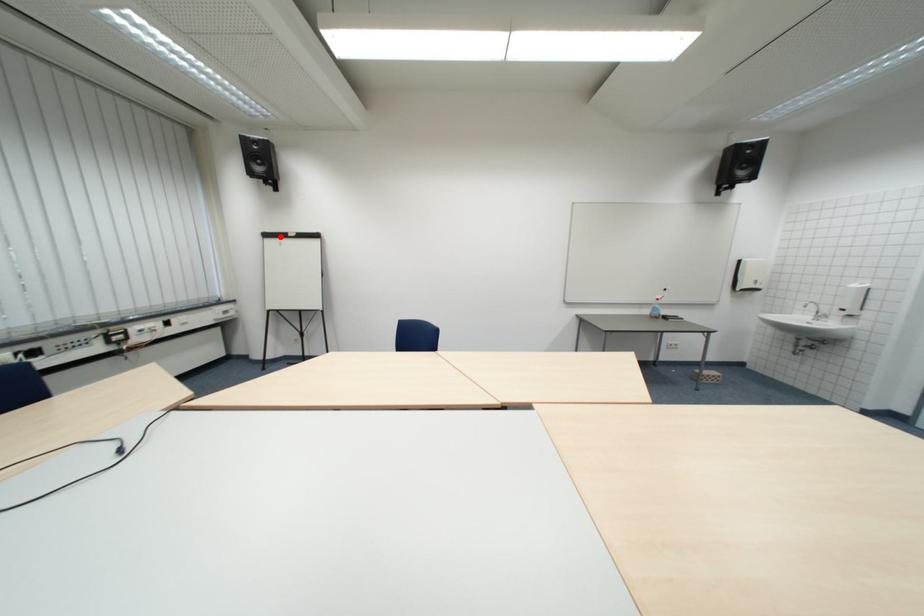
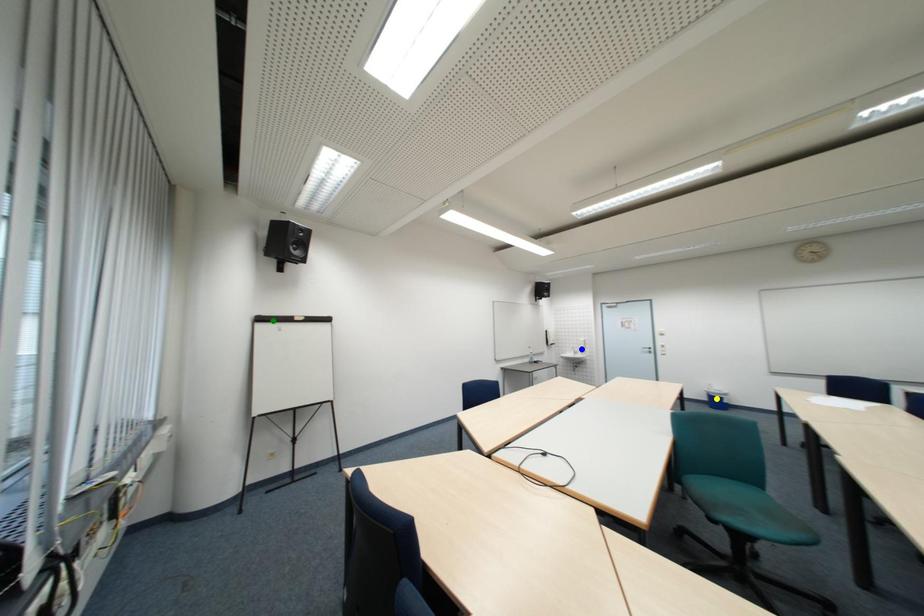
Question: I am providing you with two images of the same scene from different viewpoints. A red point is marked on the first image. You are given multiple points on the second image. Which point in image 2 represents the same 3d spot as the red point in image 1?

Choices:
 (A) yellow point
 (B) blue point
 (C) green point

Answer: (C)